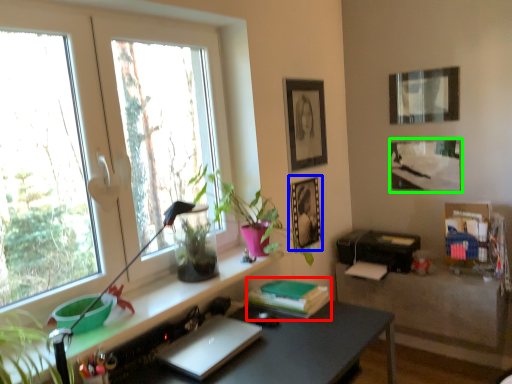
Question: Considering the real-world distances, which object is farthest from book (highlighted by a red box)? picture frame (highlighted by a blue box) or picture frame (highlighted by a green box)?

Choices:
 (A) picture frame
 (B) picture frame

Answer: (B)